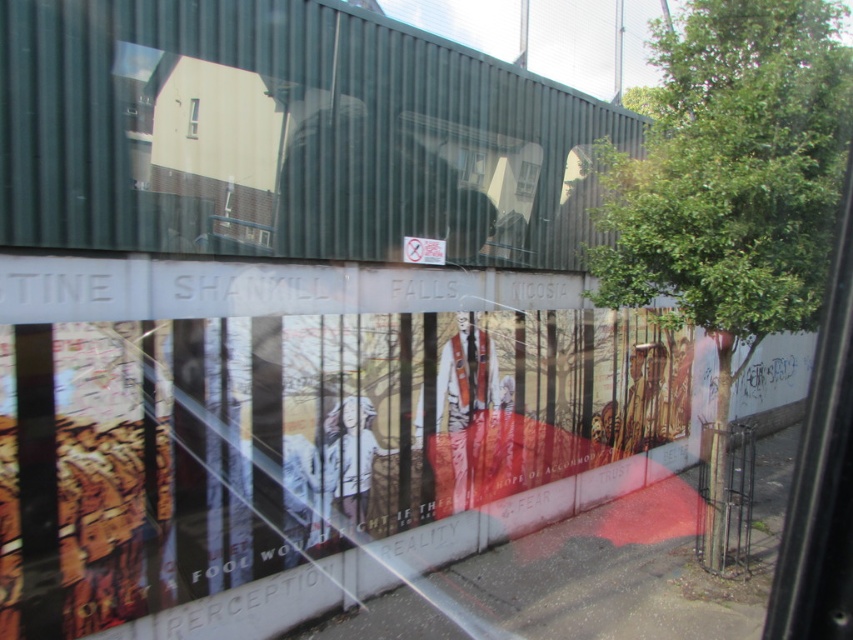
Question: Is green leafy tree at center to the right of clear glass window at upper center from the viewer's perspective?

Choices:
 (A) yes
 (B) no

Answer: (A)

Question: Which point is farther to the camera?

Choices:
 (A) (187, 129)
 (B) (727, 84)

Answer: (B)

Question: Among these objects, which one is nearest to the camera?

Choices:
 (A) clear glass window at upper center
 (B) green leafy tree at center

Answer: (A)

Question: Is green leafy tree at center to the left of clear glass window at upper center from the viewer's perspective?

Choices:
 (A) no
 (B) yes

Answer: (A)

Question: Does green leafy tree at center appear over clear glass window at upper center?

Choices:
 (A) yes
 (B) no

Answer: (B)